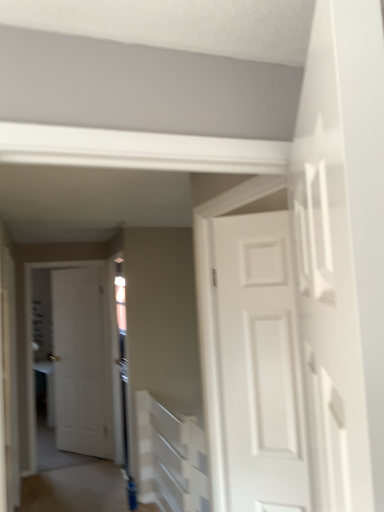
Question: In which direction should I rotate to look at white matte door at center, which appears as the second door when viewed from the front?

Choices:
 (A) right
 (B) left

Answer: (B)

Question: Should I look upward or downward to see blue glossy door at lower center?

Choices:
 (A) down
 (B) up

Answer: (A)

Question: Can you confirm if white matte door at center, the first door positioned from the left, is taller than white textured stairwell at center?

Choices:
 (A) no
 (B) yes

Answer: (B)

Question: Is white matte door at center, the first door positioned from the left, not close to white textured stairwell at center?

Choices:
 (A) yes
 (B) no

Answer: (A)

Question: Can you confirm if white matte door at center, acting as the 1th door starting from the back, is shorter than white textured stairwell at center?

Choices:
 (A) yes
 (B) no

Answer: (B)

Question: Is white matte door at center, the first door positioned from the left, not inside white textured stairwell at center?

Choices:
 (A) no
 (B) yes

Answer: (B)

Question: Is white matte door at center, the first door positioned from the left, smaller than white textured stairwell at center?

Choices:
 (A) no
 (B) yes

Answer: (B)

Question: Is white matte door at center, the first door positioned from the left, behind white textured stairwell at center?

Choices:
 (A) no
 (B) yes

Answer: (B)

Question: Is white textured stairwell at center not within white matte door at center, the first door positioned from the left?

Choices:
 (A) no
 (B) yes

Answer: (B)

Question: Is white textured stairwell at center positioned far away from white matte door at center, the first door positioned from the left?

Choices:
 (A) no
 (B) yes

Answer: (B)

Question: From a real-world perspective, is white textured stairwell at center located beneath white matte door at center, the second door when ordered from right to left?

Choices:
 (A) yes
 (B) no

Answer: (A)

Question: Is white matte door at center, acting as the 1th door starting from the back, surrounded by white textured stairwell at center?

Choices:
 (A) no
 (B) yes

Answer: (A)

Question: From the image's perspective, is white textured stairwell at center over white matte door at center, the second door when ordered from right to left?

Choices:
 (A) yes
 (B) no

Answer: (B)

Question: Considering the relative sizes of white textured stairwell at center and white matte door at center, which appears as the second door when viewed from the front, in the image provided, is white textured stairwell at center shorter than white matte door at center, which appears as the second door when viewed from the front,?

Choices:
 (A) yes
 (B) no

Answer: (A)

Question: Can you confirm if white matte door at center, which appears as the second door when viewed from the front, is thinner than blue glossy door at lower center?

Choices:
 (A) no
 (B) yes

Answer: (B)